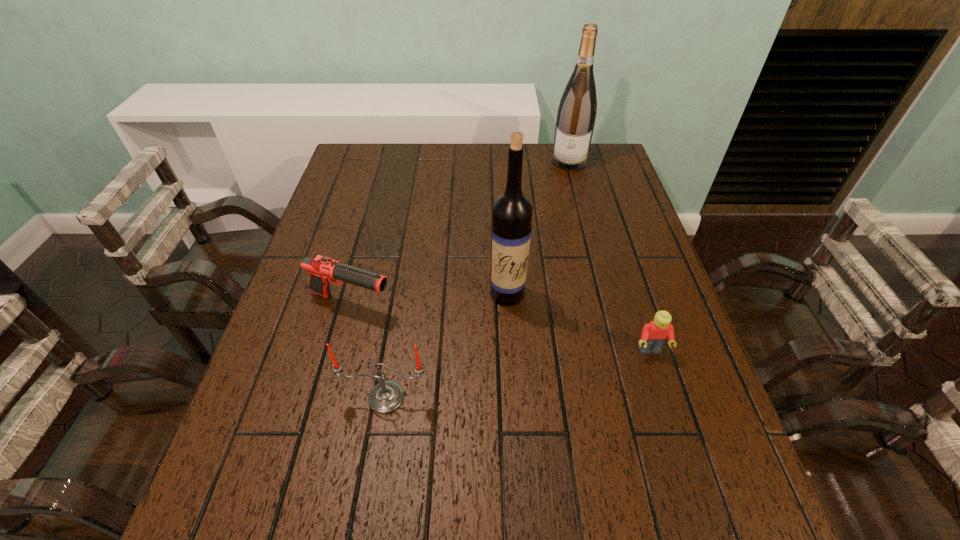
The width and height of the screenshot is (960, 540). In order to click on free point between the farther wine bottle and the nearer wine bottle in this screenshot , I will do 539,228.

What are the coordinates of `blank region between the farthest object and the third object from right to left` in the screenshot? It's located at (539, 228).

Image resolution: width=960 pixels, height=540 pixels. I want to click on unoccupied area between the gun and the Lego, so click(x=500, y=328).

You are a GUI agent. You are given a task and a screenshot of the screen. Output one action in this format:
    pyautogui.click(x=<x>, y=<y>)
    Task: Click on the empty location between the Lego and the right wine bottle
    The width and height of the screenshot is (960, 540).
    Given the screenshot: What is the action you would take?
    pyautogui.click(x=610, y=256)

This screenshot has height=540, width=960. Find the location of `vacant area that lies between the gun and the farthest object`. vacant area that lies between the gun and the farthest object is located at coordinates (460, 233).

Locate an element on the screen. This screenshot has width=960, height=540. free spot between the gun and the candle is located at coordinates (369, 350).

You are a GUI agent. You are given a task and a screenshot of the screen. Output one action in this format:
    pyautogui.click(x=<x>, y=<y>)
    Task: Click on the vacant space in between the candle and the gun
    
    Given the screenshot: What is the action you would take?
    pyautogui.click(x=369, y=350)

Where is `vacant area that lies between the Lego and the third object from right to left`? Image resolution: width=960 pixels, height=540 pixels. vacant area that lies between the Lego and the third object from right to left is located at coordinates (579, 322).

Where is `free point between the gun and the fourth farthest object`? Image resolution: width=960 pixels, height=540 pixels. free point between the gun and the fourth farthest object is located at coordinates (500, 328).

Locate an element on the screen. vacant space that's between the gun and the right wine bottle is located at coordinates (460, 233).